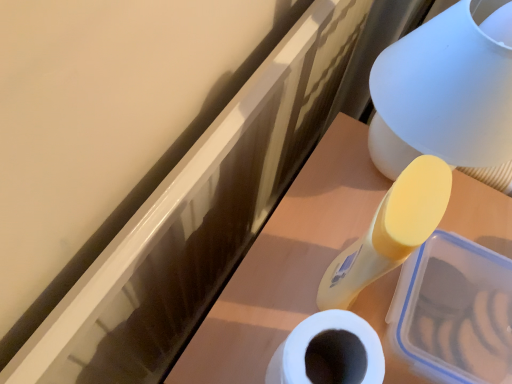
The height and width of the screenshot is (384, 512). In order to click on free space behind white matte toilet paper at lower center in this screenshot , I will do `click(318, 229)`.